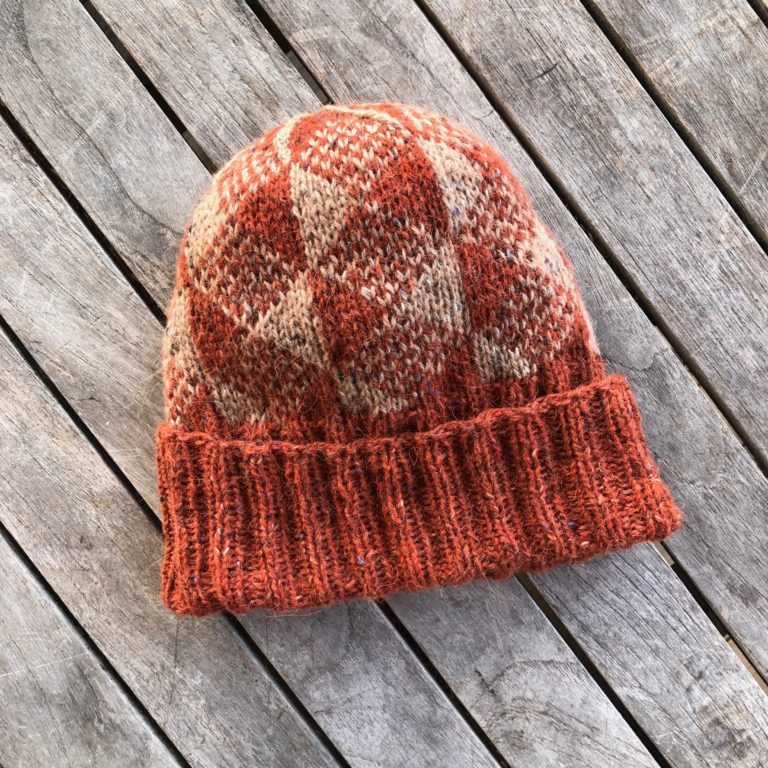
Image resolution: width=768 pixels, height=768 pixels. I want to click on wooden slat, so click(x=55, y=714), click(x=180, y=687), click(x=323, y=666), click(x=505, y=641), click(x=624, y=623), click(x=664, y=415), click(x=682, y=227), click(x=726, y=107).